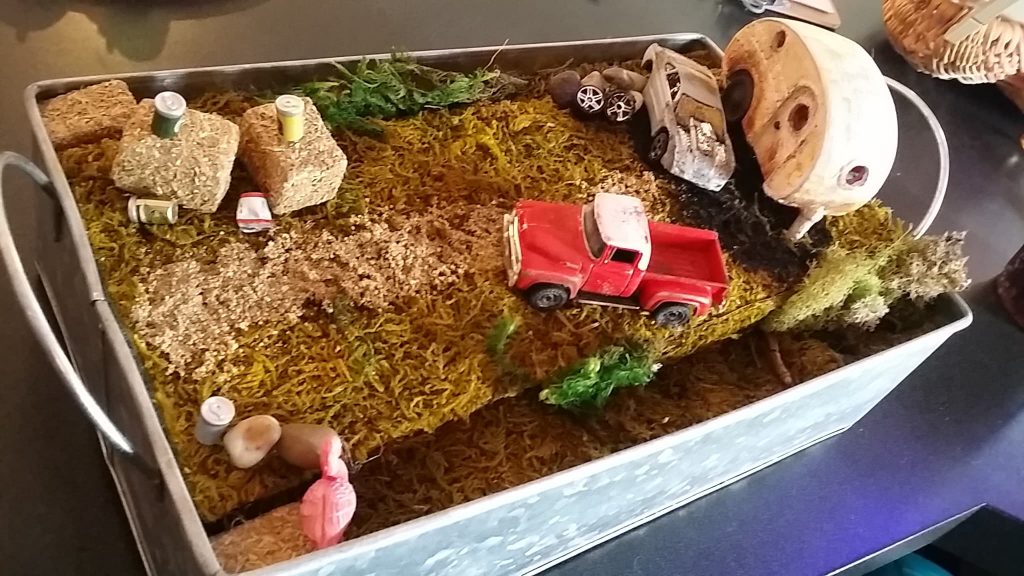
You are a GUI agent. You are given a task and a screenshot of the screen. Output one action in this format:
    pyautogui.click(x=<x>, y=<y>)
    Task: Click on the counter
    This screenshot has height=576, width=1024.
    Given the screenshot: What is the action you would take?
    pyautogui.click(x=330, y=40)